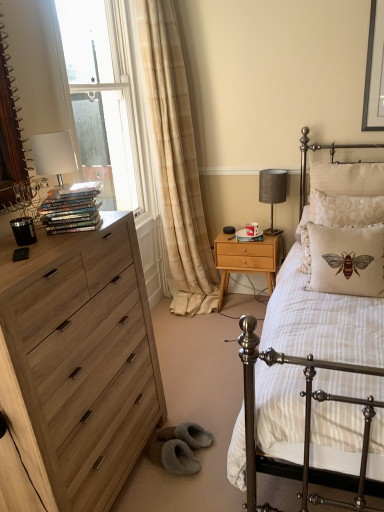
Question: Is white striped fabric at center at the right side of beige fabric curtain at left?

Choices:
 (A) no
 (B) yes

Answer: (B)

Question: Would you say white striped fabric at center is outside beige fabric curtain at left?

Choices:
 (A) no
 (B) yes

Answer: (B)

Question: Considering the relative sizes of white striped fabric at center and beige fabric curtain at left in the image provided, is white striped fabric at center taller than beige fabric curtain at left?

Choices:
 (A) yes
 (B) no

Answer: (B)

Question: Is white striped fabric at center positioned far away from beige fabric curtain at left?

Choices:
 (A) no
 (B) yes

Answer: (B)

Question: Considering the relative sizes of white striped fabric at center and beige fabric curtain at left in the image provided, is white striped fabric at center smaller than beige fabric curtain at left?

Choices:
 (A) yes
 (B) no

Answer: (B)

Question: Is point (370, 285) closer or farther from the camera than point (66, 208)?

Choices:
 (A) farther
 (B) closer

Answer: (A)

Question: Is beige embroidered pillow at right, which is counted as the 3th pillow, starting from the back, inside or outside of shiny metallic books at left?

Choices:
 (A) outside
 (B) inside

Answer: (A)

Question: From a real-world perspective, is beige embroidered pillow at right, the 1th pillow in the front-to-back sequence, positioned above or below shiny metallic books at left?

Choices:
 (A) below
 (B) above

Answer: (A)

Question: From their relative heights in the image, would you say beige embroidered pillow at right, the 1th pillow in the front-to-back sequence, is taller or shorter than shiny metallic books at left?

Choices:
 (A) tall
 (B) short

Answer: (A)

Question: Considering their positions, is light wood chest of drawers at left located in front of or behind textured gray fabric lampshade at right?

Choices:
 (A) behind
 (B) front

Answer: (B)

Question: From the image's perspective, is light wood chest of drawers at left above or below textured gray fabric lampshade at right?

Choices:
 (A) below
 (B) above

Answer: (A)

Question: Does point (109, 224) appear closer or farther from the camera than point (259, 193)?

Choices:
 (A) closer
 (B) farther

Answer: (A)

Question: Would you say light wood chest of drawers at left is inside or outside textured gray fabric lampshade at right?

Choices:
 (A) outside
 (B) inside

Answer: (A)

Question: Is point (274, 284) closer or farther from the camera than point (380, 222)?

Choices:
 (A) closer
 (B) farther

Answer: (B)

Question: Is light wood/texture nightstand at center taller or shorter than beige damask pillow at right, marked as the second pillow in a back-to-front arrangement?

Choices:
 (A) short
 (B) tall

Answer: (B)